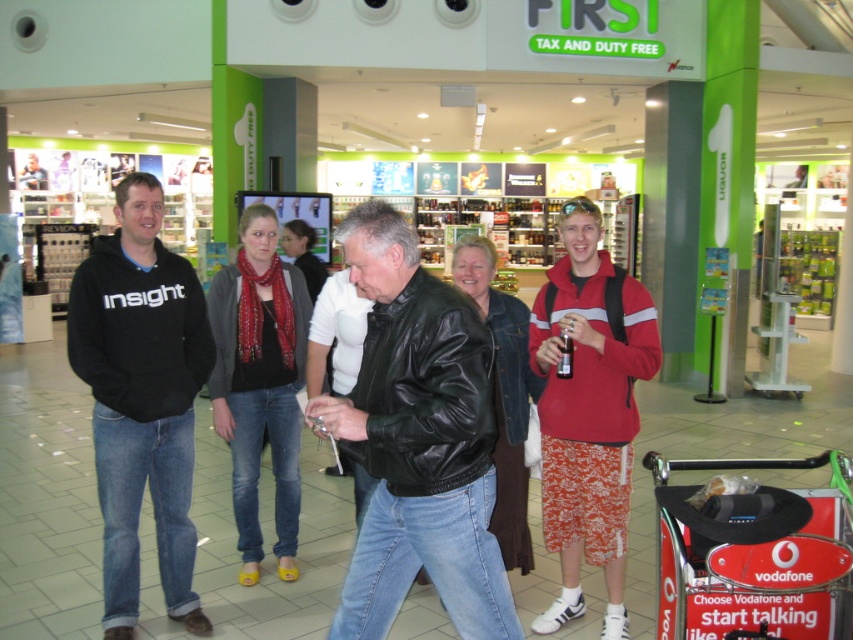
Based on the photo, who is more distant from viewer, [412,436] or [589,561]?

The point [589,561] is more distant.

Image resolution: width=853 pixels, height=640 pixels. Describe the element at coordinates (416, 440) in the screenshot. I see `black leather jacket at center` at that location.

This screenshot has width=853, height=640. Identify the location of black leather jacket at center. (416, 440).

Who is taller, black hoodie at left or red polyester hoodie at center?

With more height is black hoodie at left.

Can you confirm if black hoodie at left is positioned above red polyester hoodie at center?

Yes.

Is point (129, 324) positioned in front of point (537, 360)?

Yes.

The image size is (853, 640). What are the coordinates of `black hoodie at left` in the screenshot? It's located at pos(141,400).

Does black leather jacket at center come in front of black hoodie at left?

Yes, it is in front of black hoodie at left.

Does black leather jacket at center lie behind black hoodie at left?

That is False.

Who is more forward, [386,570] or [171,294]?

Point [386,570] is in front.

Locate an element on the screen. This screenshot has width=853, height=640. black leather jacket at center is located at coordinates (416, 440).